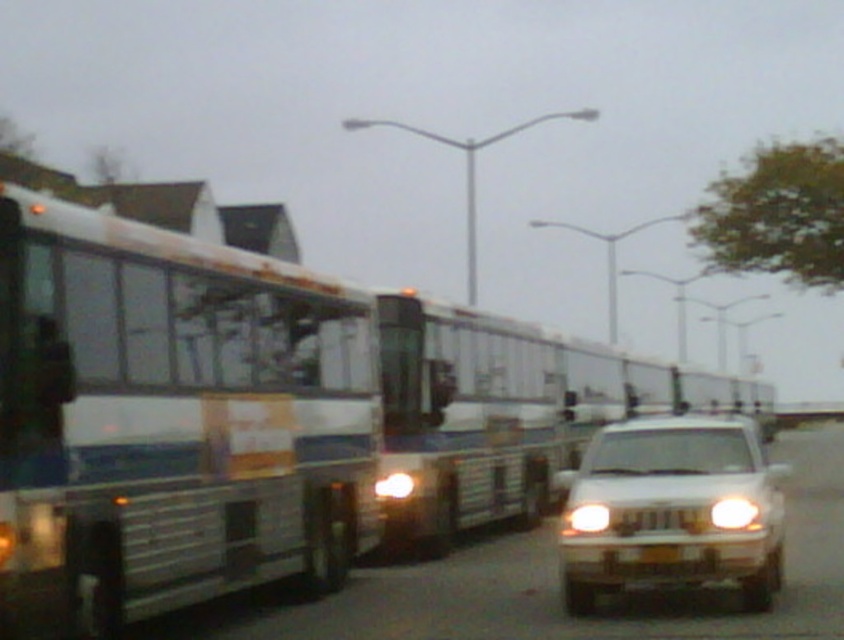
Between point (420, 342) and point (769, 522), which one is positioned behind?

Positioned behind is point (420, 342).

Image resolution: width=844 pixels, height=640 pixels. What do you see at coordinates (507, 412) in the screenshot?
I see `white glossy bus at center` at bounding box center [507, 412].

At what (x,y) coordinates should I click in order to perform the action: click on white glossy bus at center. Please return your answer as a coordinate pair (x, y). Looking at the image, I should click on (507, 412).

Image resolution: width=844 pixels, height=640 pixels. Describe the element at coordinates (674, 509) in the screenshot. I see `white glossy suv at lower right` at that location.

The width and height of the screenshot is (844, 640). I want to click on white glossy suv at lower right, so click(x=674, y=509).

Is white glossy bus at center below white plastic headlight at center?

Correct, white glossy bus at center is located below white plastic headlight at center.

Is white glossy bus at center thinner than white plastic headlight at center?

Incorrect, white glossy bus at center's width is not less than white plastic headlight at center's.

I want to click on white glossy bus at center, so click(507, 412).

Identify the location of white glossy bus at center. The image size is (844, 640). (507, 412).